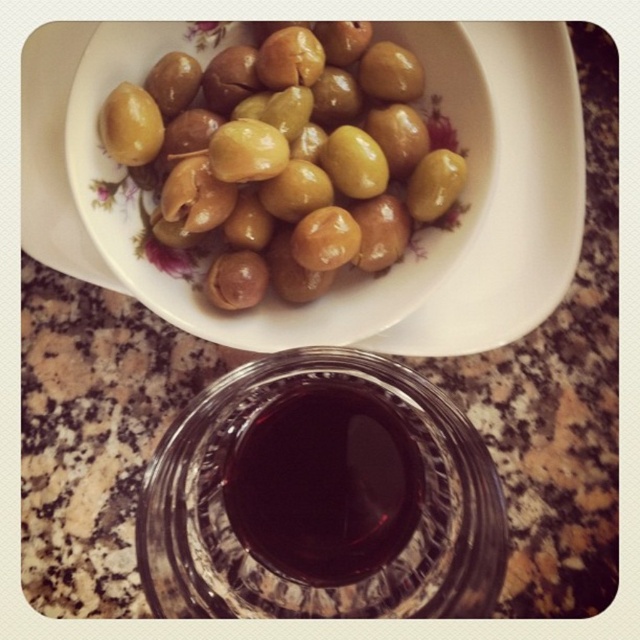
You are a chef preparing a dish and need to pour the dark glass wine at center into the transparent glass bowl at center. Based on their positions, will the bowl be able to hold the wine without spilling?

The transparent glass bowl at center is in front of dark glass wine at center, so the bowl is closer to you. To pour the wine into the bowl, you would need to move the bowl behind the wine, but since they are both at the center, their positions might overlap. However, since the bowl is in front, it can catch the wine if poured correctly, so yes, it can hold the wine without spilling if carefully done.

You are a chef preparing a dish and need to pour the liquid from the transparent glass bowl at center into a container. If you move the green glossy olives at upper center out of the way, will you have enough space to pour the liquid without spilling?

The transparent glass bowl at center is in front of the green glossy olives at upper center, so moving the olives aside would provide clear access to the bowl. This should allow you to pour the liquid without spilling.